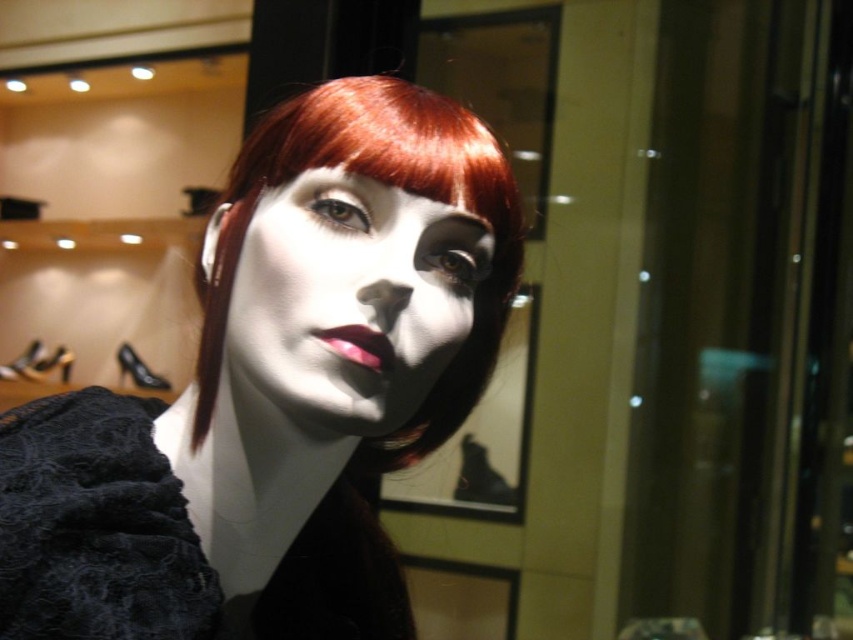
Question: Is matte black wig at center positioned in front of matte white face at center?

Choices:
 (A) no
 (B) yes

Answer: (B)

Question: Is matte black wig at center to the left of matte pink lipstick at center from the viewer's perspective?

Choices:
 (A) yes
 (B) no

Answer: (A)

Question: Which of the following is the closest to the observer?

Choices:
 (A) matte black wig at center
 (B) matte pink lipstick at center
 (C) matte white face at center

Answer: (A)

Question: Can you confirm if matte black wig at center is thinner than matte pink lipstick at center?

Choices:
 (A) no
 (B) yes

Answer: (A)

Question: Which object appears closest to the camera in this image?

Choices:
 (A) matte black wig at center
 (B) lace fabric dress at center
 (C) matte pink lipstick at center
 (D) matte white face at center

Answer: (A)

Question: Estimate the real-world distances between objects in this image. Which object is closer to the matte white face at center?

Choices:
 (A) lace fabric dress at center
 (B) matte black wig at center
 (C) matte pink lipstick at center

Answer: (C)